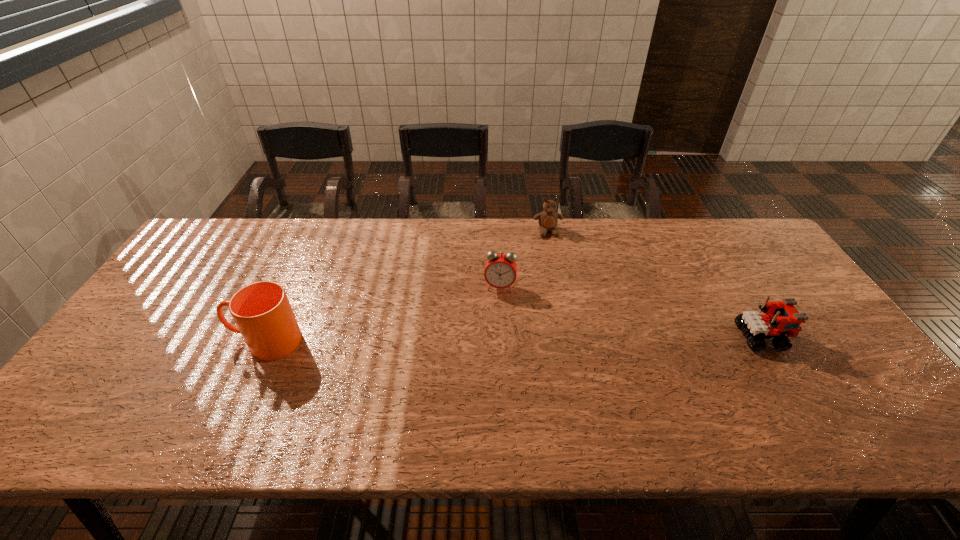
The height and width of the screenshot is (540, 960). Identify the location of vacant area that lies between the second farthest object and the second object from right to left. (524, 259).

Where is `unoccupied area between the third nearest object and the leftmost object`? The image size is (960, 540). unoccupied area between the third nearest object and the leftmost object is located at coordinates (383, 314).

The width and height of the screenshot is (960, 540). I want to click on unoccupied position between the leftmost object and the Lego, so click(x=514, y=340).

This screenshot has height=540, width=960. Identify the location of free space between the third object from left to right and the second object from left to right. (524, 259).

Identify the location of object that is the third nearest to the tallest object. 782,318.

This screenshot has width=960, height=540. Identify the location of object that is the second closest to the rightmost object. (500, 272).